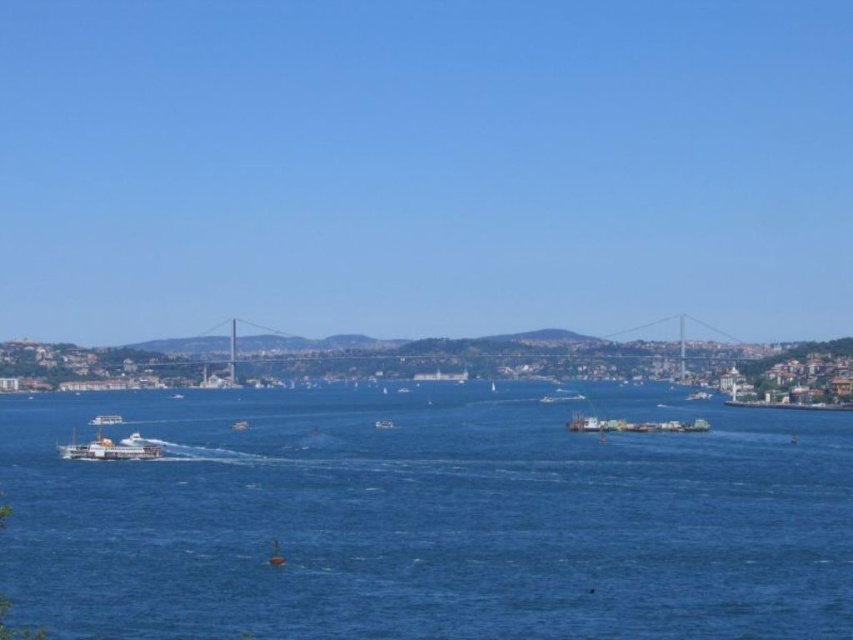
Question: Which object is farther from the camera taking this photo?

Choices:
 (A) wooden sailboat at center
 (B) white matte ferry at lower left
 (C) white plastic boat at center
 (D) metallic gray cargo ship at center

Answer: (C)

Question: Which point appears closest to the camera in this image?

Choices:
 (A) (281, 563)
 (B) (612, 419)

Answer: (A)

Question: Is white matte ferry at lower left below wooden sailboat at center?

Choices:
 (A) no
 (B) yes

Answer: (A)

Question: Is blue water at center wider than wooden sailboat at center?

Choices:
 (A) no
 (B) yes

Answer: (B)

Question: Which point is closer to the camera?

Choices:
 (A) (270, 560)
 (B) (651, 422)

Answer: (A)

Question: Observing the image, what is the correct spatial positioning of white matte ferry at lower left in reference to wooden sailboat at center?

Choices:
 (A) right
 (B) left

Answer: (B)